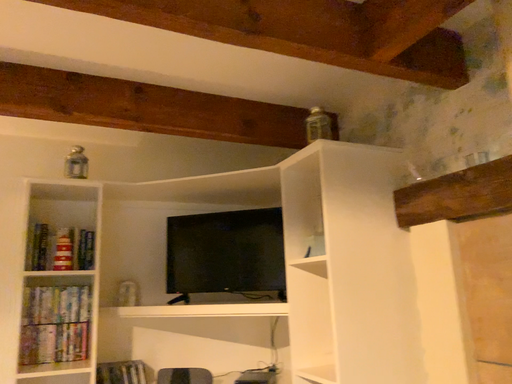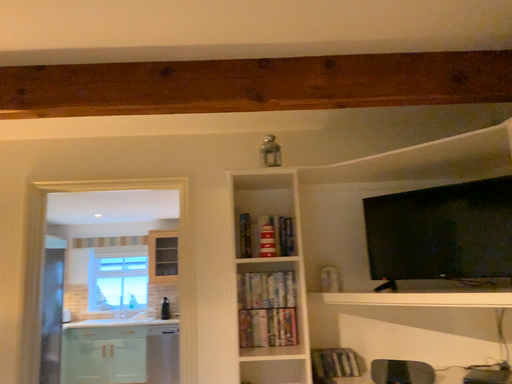
Question: How did the camera likely rotate when shooting the video?

Choices:
 (A) rotated left
 (B) rotated right

Answer: (A)